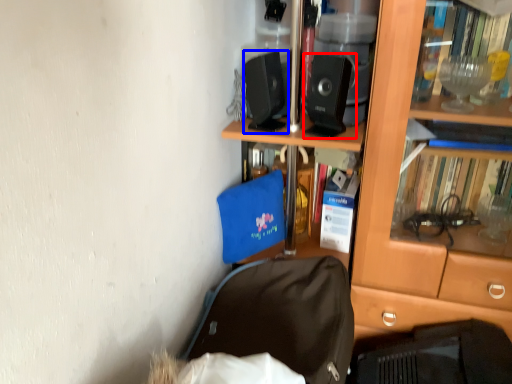
Question: Which point is further to the camera, loudspeaker (highlighted by a red box) or loudspeaker (highlighted by a blue box)?

Choices:
 (A) loudspeaker
 (B) loudspeaker

Answer: (B)